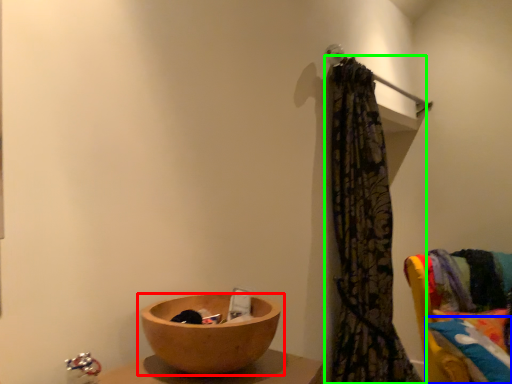
Question: Considering the real-world distances, which object is farthest from tableware (highlighted by a red box)? pillow (highlighted by a blue box) or curtain (highlighted by a green box)?

Choices:
 (A) pillow
 (B) curtain

Answer: (A)